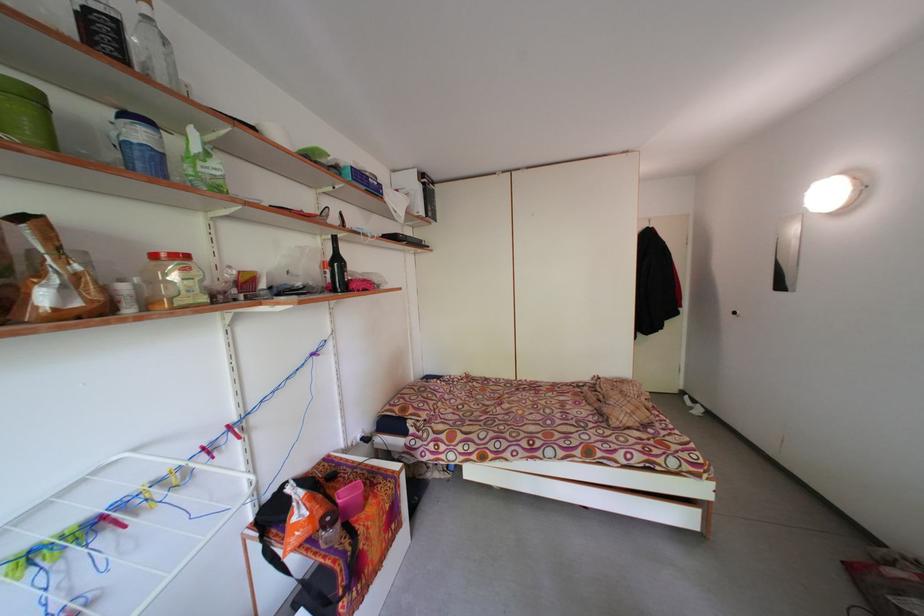
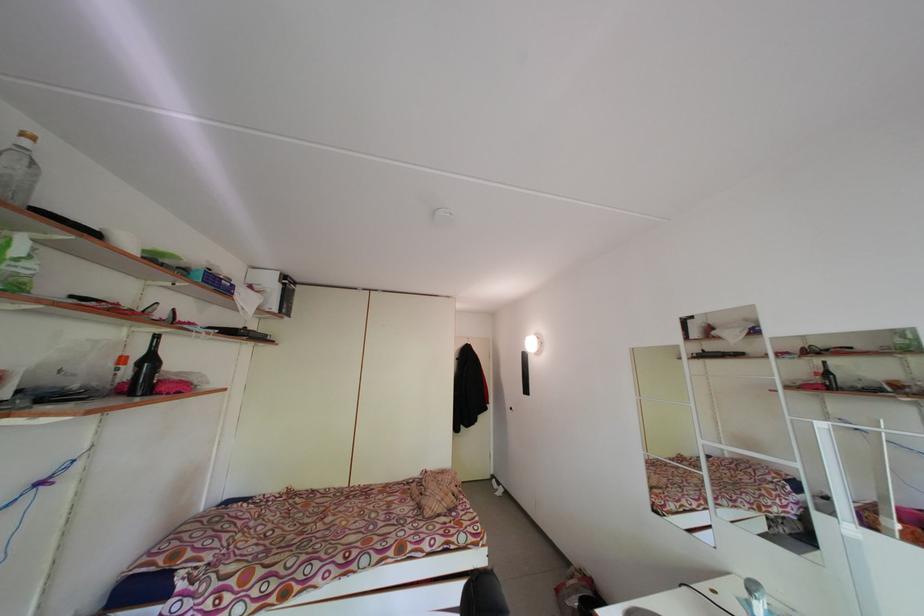
First-person continuous shooting, in which direction is the camera rotating?

The camera rotated toward right-up.